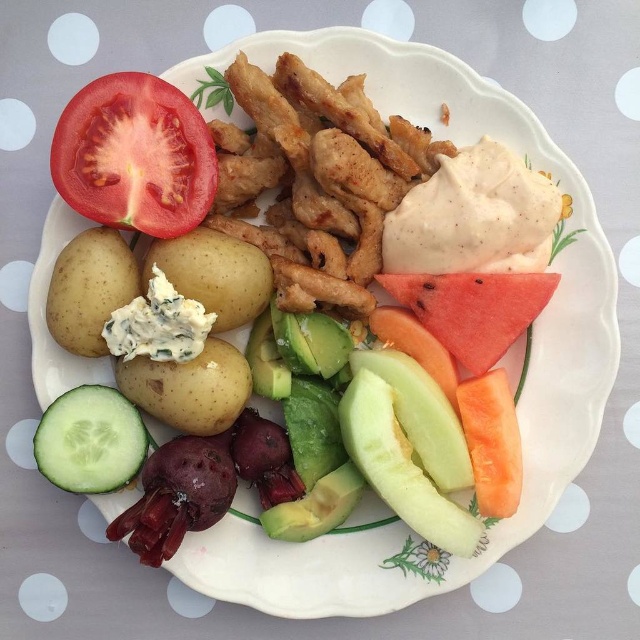
Question: Which of the following is the closest to the observer?

Choices:
 (A) (204, 374)
 (B) (218, 240)
 (C) (525, 324)

Answer: (A)

Question: Is smooth yellow potato at center-left smaller than blue cheese potato at center?

Choices:
 (A) yes
 (B) no

Answer: (A)

Question: Which of the following is the farthest from the observer?

Choices:
 (A) (182, 264)
 (B) (460, 353)

Answer: (B)

Question: Does green smooth cucumber at lower left appear on the left side of blue cheese potato at center?

Choices:
 (A) no
 (B) yes

Answer: (B)

Question: Is red matte tomato at upper left closer to the viewer compared to smooth yellow potato at center-left?

Choices:
 (A) no
 (B) yes

Answer: (B)

Question: Which object is farther from the camera taking this photo?

Choices:
 (A) red matte watermelon at center-right
 (B) green smooth cucumber at lower left

Answer: (A)